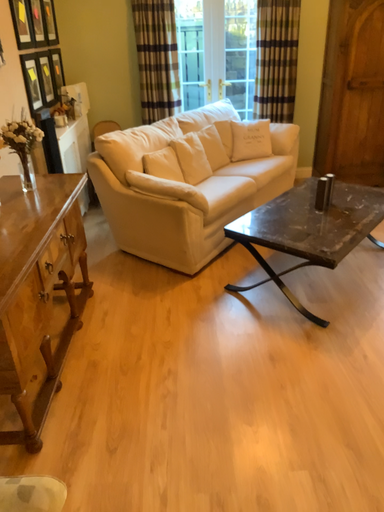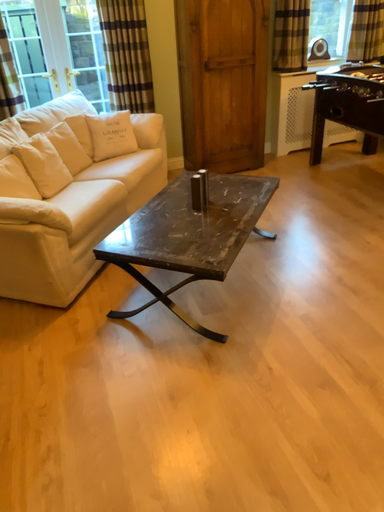
Question: Which way did the camera rotate in the video?

Choices:
 (A) rotated right
 (B) rotated left

Answer: (A)